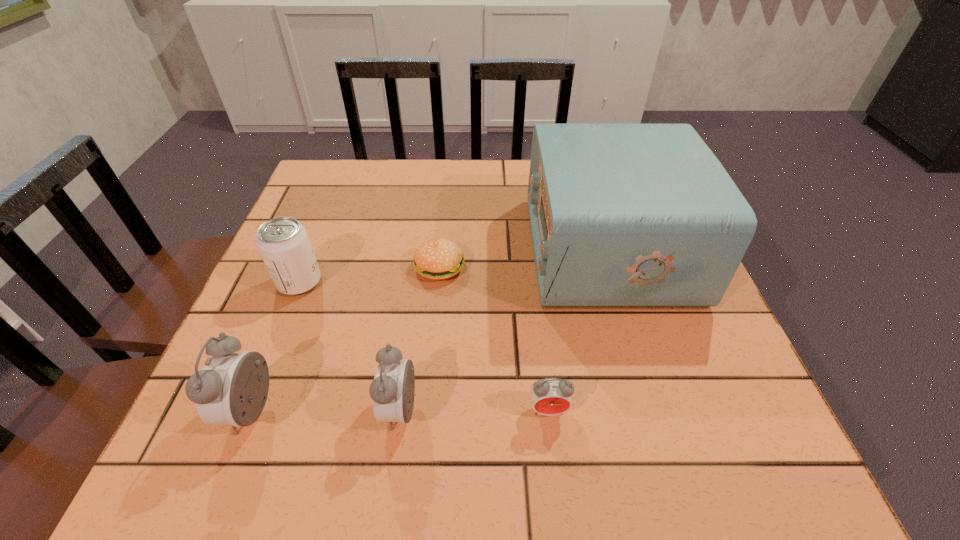
Where is `the leftmost alarm clock`? The height and width of the screenshot is (540, 960). the leftmost alarm clock is located at coordinates (232, 388).

This screenshot has height=540, width=960. I want to click on the second alarm clock from right to left, so click(x=392, y=390).

Identify the location of the second shortest object. (550, 396).

Where is `the shortest alarm clock`? the shortest alarm clock is located at coordinates (550, 396).

Locate an element on the screen. This screenshot has height=540, width=960. patty is located at coordinates (437, 259).

Identify the location of soda can. (283, 243).

Where is `the tallest object`? The image size is (960, 540). the tallest object is located at coordinates (622, 215).

Locate an element on the screen. vacant space located 0.310m on the face of the second shortest alarm clock is located at coordinates (198, 411).

In order to click on vacant space located 0.090m on the face of the second shortest alarm clock in this screenshot , I will do `click(329, 411)`.

Where is `vacant space located 0.080m on the face of the second shortest alarm clock`? The height and width of the screenshot is (540, 960). vacant space located 0.080m on the face of the second shortest alarm clock is located at coordinates (336, 411).